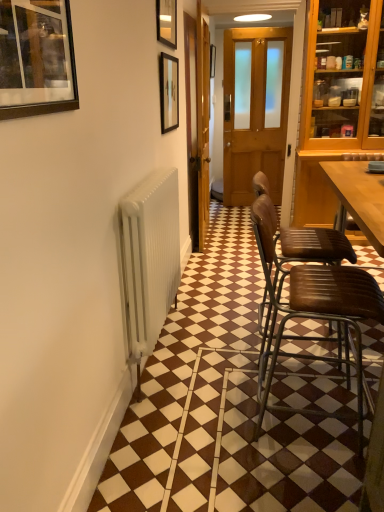
You are a GUI agent. You are given a task and a screenshot of the screen. Output one action in this format:
    pyautogui.click(x=<x>, y=<y>)
    Task: Click on the free region under brown leather chair at right, the 2th chair viewed from the front (from a real-world perspective)
    The width and height of the screenshot is (384, 512).
    Given the screenshot: What is the action you would take?
    pyautogui.click(x=306, y=342)